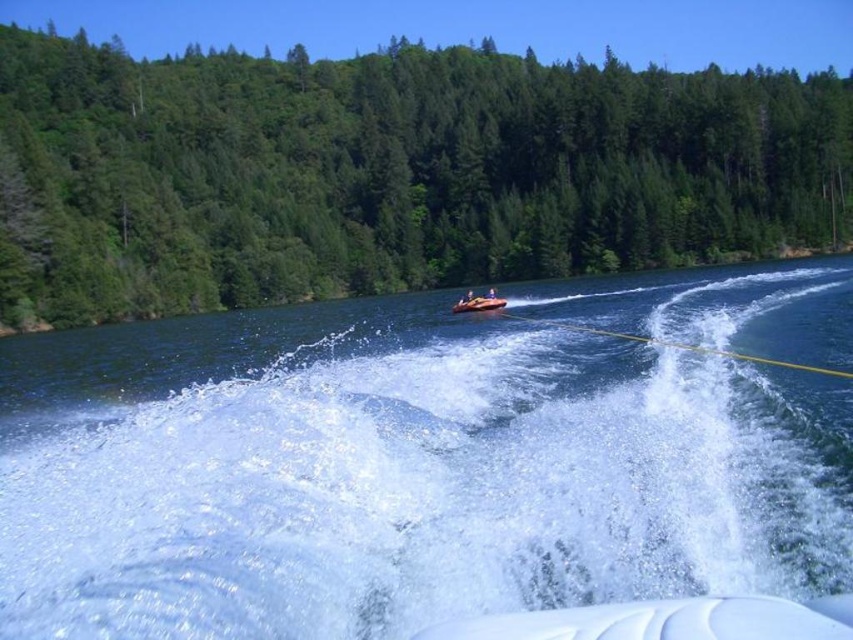
Between clear water at center and orange rubber raft at center, which one appears on the left side from the viewer's perspective?

Positioned to the left is orange rubber raft at center.

This screenshot has width=853, height=640. I want to click on clear water at center, so click(x=398, y=474).

Which is in front, point (194, 477) or point (494, 298)?

Positioned in front is point (194, 477).

Where is `clear water at center`? The height and width of the screenshot is (640, 853). clear water at center is located at coordinates (398, 474).

Can you confirm if green textured trees at center is smaller than orange rubber raft at center?

Incorrect, green textured trees at center is not smaller in size than orange rubber raft at center.

Between point (196, 65) and point (496, 305), which one is positioned in front?

Point (496, 305)

Which is in front, point (189, 74) or point (492, 308)?

Point (492, 308)

Where is `green textured trees at center`? Image resolution: width=853 pixels, height=640 pixels. green textured trees at center is located at coordinates (389, 172).

Does clear water at center lie in front of green textured trees at center?

That is True.

This screenshot has height=640, width=853. What do you see at coordinates (398, 474) in the screenshot? I see `clear water at center` at bounding box center [398, 474].

Is point (648, 557) positioned before point (57, 230)?

Yes.

Identify the location of clear water at center. (398, 474).